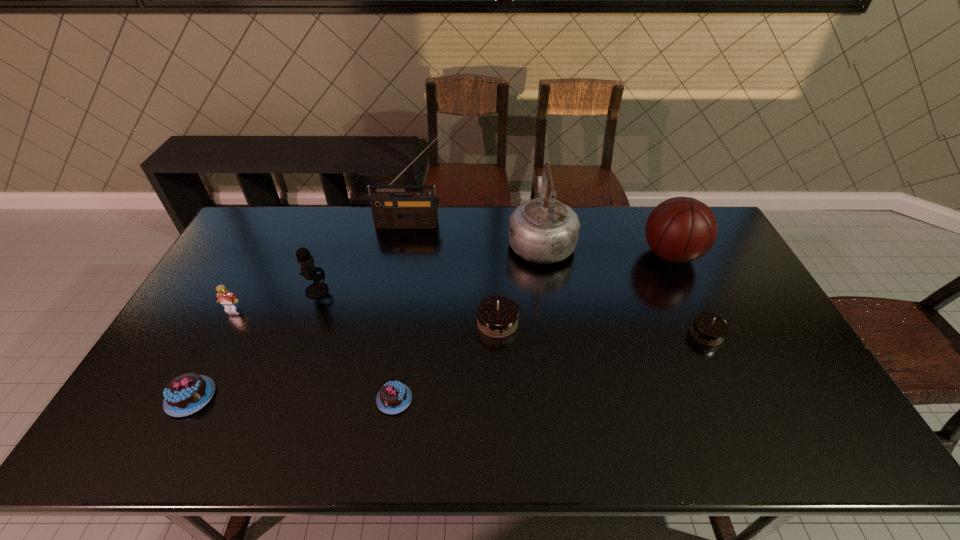
Where is `blank region between the smaller chocolate chocolate cake and the shortest object`? blank region between the smaller chocolate chocolate cake and the shortest object is located at coordinates (550, 367).

At what (x,y) coordinates should I click in order to perform the action: click on blank region between the eighth shortest object and the smaller pink chocolate cake. Please return your answer as a coordinate pair (x, y). Looking at the image, I should click on (468, 320).

I want to click on empty space that is in between the rightmost chocolate cake and the tallest chocolate cake, so click(x=602, y=328).

Identify the location of the fifth closest object to the kettle. (394, 397).

Locate an element on the screen. object that can be found as the second closest to the left chocolate chocolate cake is located at coordinates (394, 397).

Select which chocolate cake appears as the second closest to the rightmost chocolate cake. Please provide its 2D coordinates. Your answer should be formatted as a tuple, i.e. [(x, y)], where the tuple contains the x and y coordinates of a point satisfying the conditions above.

[(394, 397)]

Identify which chocolate cake is the second nearest to the kettle. Please provide its 2D coordinates. Your answer should be formatted as a tuple, i.e. [(x, y)], where the tuple contains the x and y coordinates of a point satisfying the conditions above.

[(709, 329)]

Where is `vacant space that satisfies the following two spatial constraints: 1. on the front-facing side of the Lego; 2. on the right side of the leftmost chocolate cake`? vacant space that satisfies the following two spatial constraints: 1. on the front-facing side of the Lego; 2. on the right side of the leftmost chocolate cake is located at coordinates (184, 397).

The height and width of the screenshot is (540, 960). I want to click on vacant region that satisfies the following two spatial constraints: 1. on the front side of the sixth nearest object; 2. on the right side of the smaller chocolate chocolate cake, so click(301, 334).